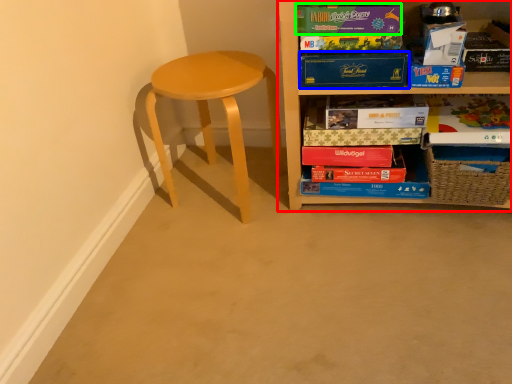
Question: Estimate the real-world distances between objects in this image. Which object is closer to shelf (highlighted by a red box), paperback book (highlighted by a blue box) or paperback book (highlighted by a green box)?

Choices:
 (A) paperback book
 (B) paperback book

Answer: (A)